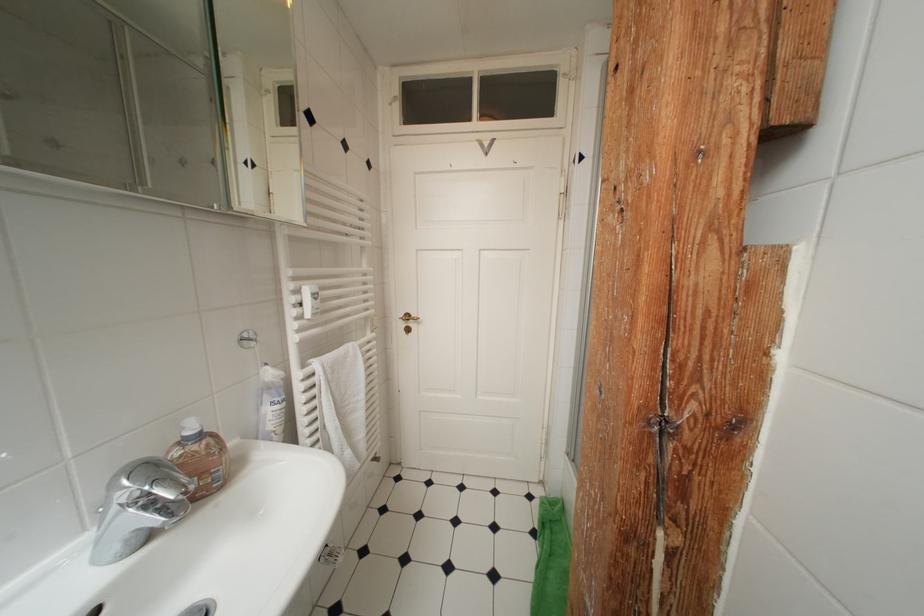
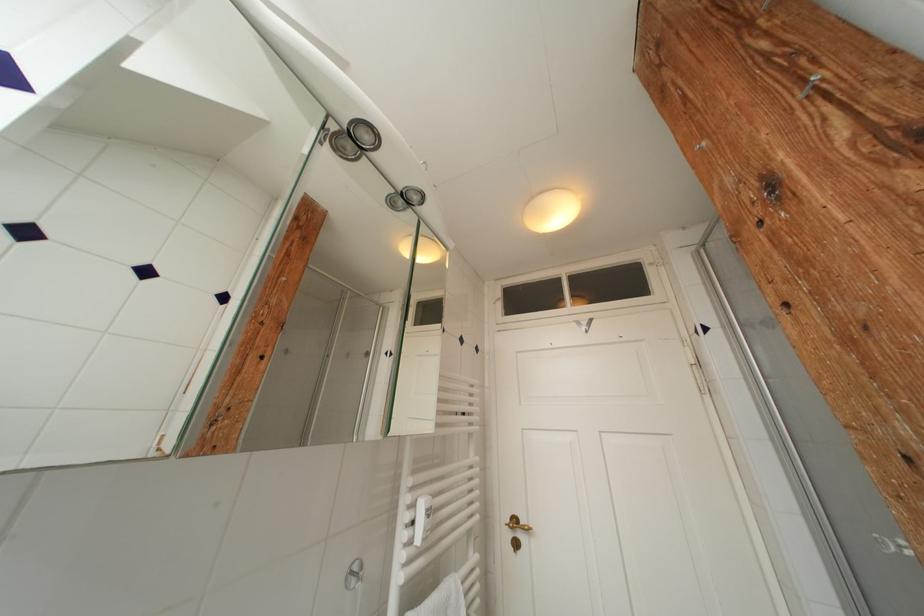
Find the pixel in the second image that matches pixel 370 241 in the first image.

(478, 427)